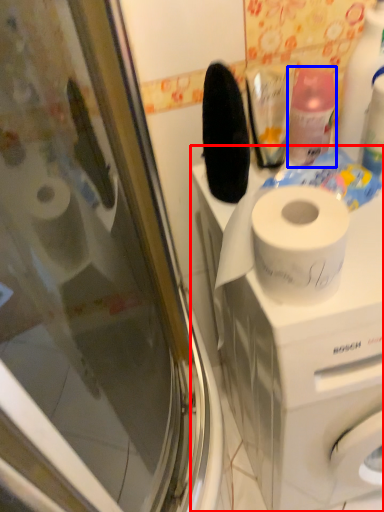
Question: Which point is further to the camera, washing machine (highlighted by a red box) or cleaning product (highlighted by a blue box)?

Choices:
 (A) washing machine
 (B) cleaning product

Answer: (B)